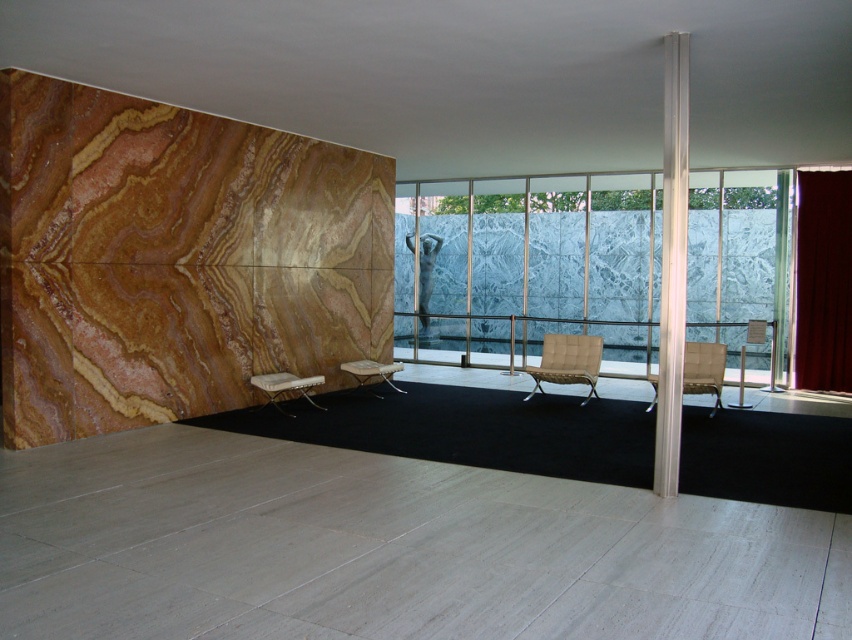
Question: Which point is farther to the camera?

Choices:
 (A) white leather armchair at center
 (B) beige leather armchair at center
 (C) white woven fabric armchair at center

Answer: (C)

Question: Is white glossy pillar at right behind beige leather armchair at center?

Choices:
 (A) no
 (B) yes

Answer: (A)

Question: Does white glossy pillar at right have a smaller size compared to white woven fabric armchair at center?

Choices:
 (A) no
 (B) yes

Answer: (A)

Question: Is the position of light beige fabric armchair at right more distant than that of white woven fabric armchair at center?

Choices:
 (A) no
 (B) yes

Answer: (A)

Question: Among these points, which one is nearest to the camera?

Choices:
 (A) (320, 406)
 (B) (377, 371)
 (C) (730, 404)

Answer: (A)

Question: Which of these objects is positioned farthest from the white woven fabric armchair at center?

Choices:
 (A) light beige fabric armchair at right
 (B) matte beige armchair at right
 (C) white glossy pillar at right
 (D) beige leather armchair at center

Answer: (B)